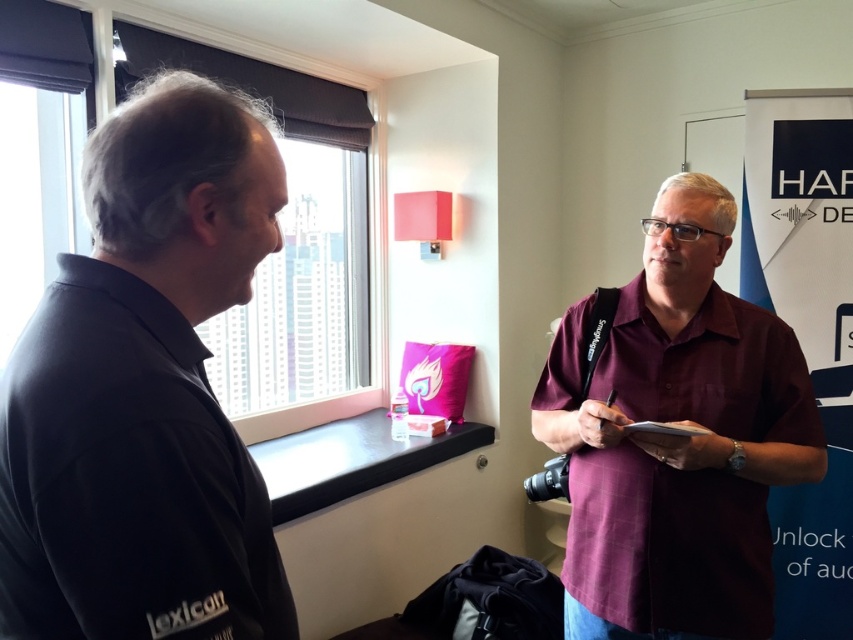
Is black matte shirt at left closer to camera compared to maroon plaid shirt at right?

Yes, black matte shirt at left is in front of maroon plaid shirt at right.

Can you confirm if black matte shirt at left is positioned above maroon plaid shirt at right?

Indeed, black matte shirt at left is positioned over maroon plaid shirt at right.

Is point (90, 262) positioned behind point (608, 596)?

That is False.

At what (x,y) coordinates should I click in order to perform the action: click on black matte shirt at left. Please return your answer as a coordinate pair (x, y). The image size is (853, 640). Looking at the image, I should click on (144, 392).

From the picture: Can you confirm if maroon plaid shirt at right is shorter than transparent glass window at upper left?

Correct, maroon plaid shirt at right is not as tall as transparent glass window at upper left.

Is maroon plaid shirt at right below transparent glass window at upper left?

Indeed, maroon plaid shirt at right is positioned under transparent glass window at upper left.

Identify the location of maroon plaid shirt at right. This screenshot has height=640, width=853. (677, 438).

Who is taller, transparent glass window at upper left or dark matte window at upper left?

Standing taller between the two is dark matte window at upper left.

Does transparent glass window at upper left have a smaller size compared to dark matte window at upper left?

Yes.

Is point (7, 209) closer to camera compared to point (96, 29)?

Yes, it is.

Image resolution: width=853 pixels, height=640 pixels. Find the location of `transparent glass window at upper left`. transparent glass window at upper left is located at coordinates point(38,152).